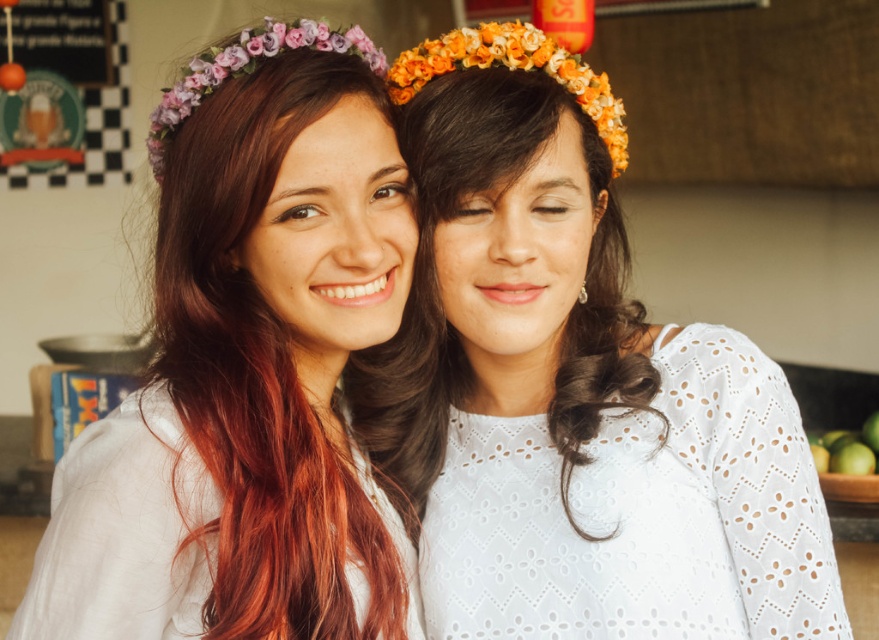
Question: Is matte floral crown at upper left to the right of green matte apples at lower right from the viewer's perspective?

Choices:
 (A) no
 (B) yes

Answer: (A)

Question: Which point appears farthest from the camera in this image?

Choices:
 (A) (429, 301)
 (B) (870, 426)
 (C) (608, 593)
 (D) (74, 552)

Answer: (B)

Question: Which point is farther to the camera?

Choices:
 (A) white lace dress at center
 (B) matte floral crown at upper left
 (C) green matte apples at lower right

Answer: (C)

Question: Does dark brown silky hair at center appear on the right side of green matte apples at lower right?

Choices:
 (A) no
 (B) yes

Answer: (A)

Question: Based on their relative distances, which object is farther from the dark brown silky hair at center?

Choices:
 (A) green matte apples at lower right
 (B) matte floral crown at upper left
 (C) white lace dress at center

Answer: (A)

Question: Can you confirm if white lace dress at center is wider than matte floral crown at upper left?

Choices:
 (A) yes
 (B) no

Answer: (A)